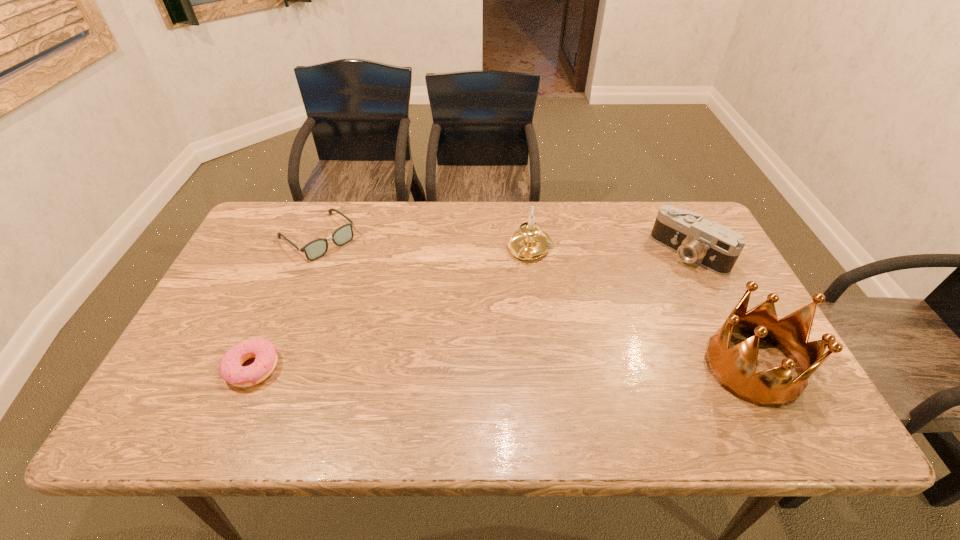
Image resolution: width=960 pixels, height=540 pixels. In order to click on free spot at the far edge of the desktop in this screenshot , I will do `click(587, 244)`.

The width and height of the screenshot is (960, 540). In the image, there is a desktop. In order to click on vacant space at the near edge in this screenshot , I will do `click(682, 382)`.

Find the location of a particular element. free location at the left edge is located at coordinates (285, 269).

Identify the location of vacant space at the near left corner of the desktop. The height and width of the screenshot is (540, 960). (215, 384).

Identify the location of free space between the camera and the third object from left to right. coord(609,251).

Locate an element on the screen. vacant space that is in between the third object from left to right and the third tallest object is located at coordinates (609, 251).

You are a GUI agent. You are given a task and a screenshot of the screen. Output one action in this format:
    pyautogui.click(x=<x>, y=<y>)
    Task: Click on the free space that is in between the doughnut and the tallest object
    
    Given the screenshot: What is the action you would take?
    pyautogui.click(x=502, y=367)

This screenshot has height=540, width=960. What are the coordinates of `blank region between the candle holder and the crown` in the screenshot? It's located at (640, 308).

Identify the location of vacant space that's between the shortest object and the spectacles. Image resolution: width=960 pixels, height=540 pixels. (285, 302).

The height and width of the screenshot is (540, 960). Find the location of `vacant point located between the tallest object and the third tallest object`. vacant point located between the tallest object and the third tallest object is located at coordinates pyautogui.click(x=721, y=310).